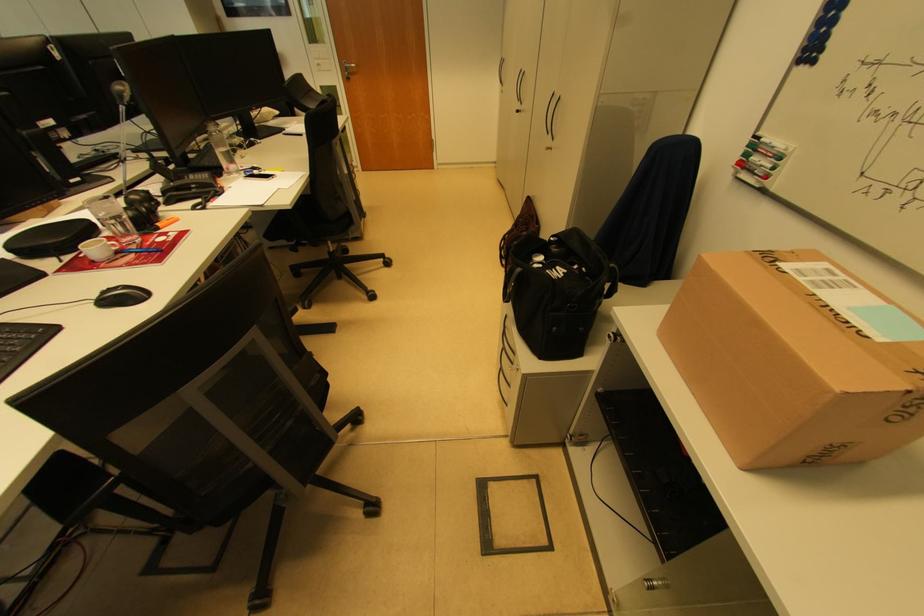
Image resolution: width=924 pixels, height=616 pixels. I want to click on black chair sitting surface, so click(313, 217).